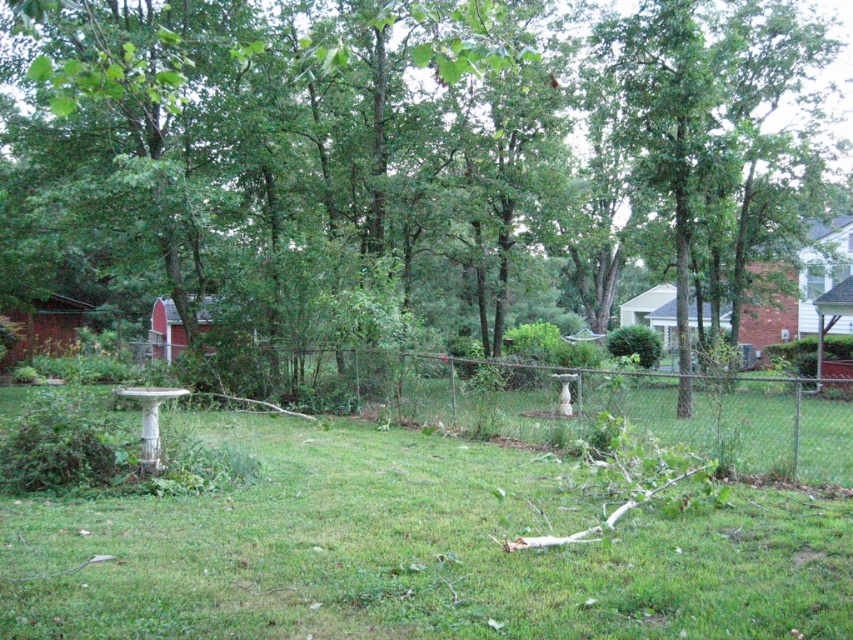
Question: Can you confirm if green leafy tree at center is positioned below green grassy at center?

Choices:
 (A) no
 (B) yes

Answer: (A)

Question: Which object is closer to the camera taking this photo?

Choices:
 (A) green leafy tree at center
 (B) green grassy at center

Answer: (B)

Question: Among these objects, which one is nearest to the camera?

Choices:
 (A) green grassy at center
 (B) green leafy tree at center

Answer: (A)

Question: Is green leafy tree at center in front of green grassy at center?

Choices:
 (A) yes
 (B) no

Answer: (B)

Question: Does green leafy tree at center come in front of green grassy at center?

Choices:
 (A) yes
 (B) no

Answer: (B)